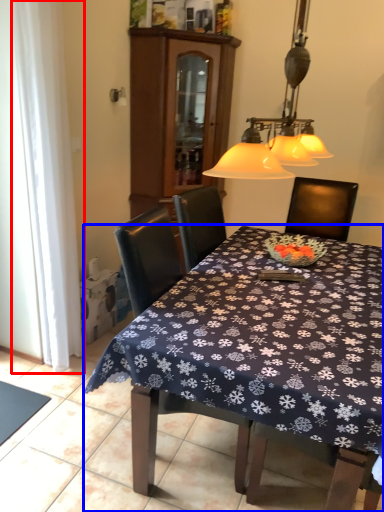
Question: Among these objects, which one is farthest to the camera, curtain (highlighted by a red box) or kitchen & dining room table (highlighted by a blue box)?

Choices:
 (A) curtain
 (B) kitchen & dining room table

Answer: (A)